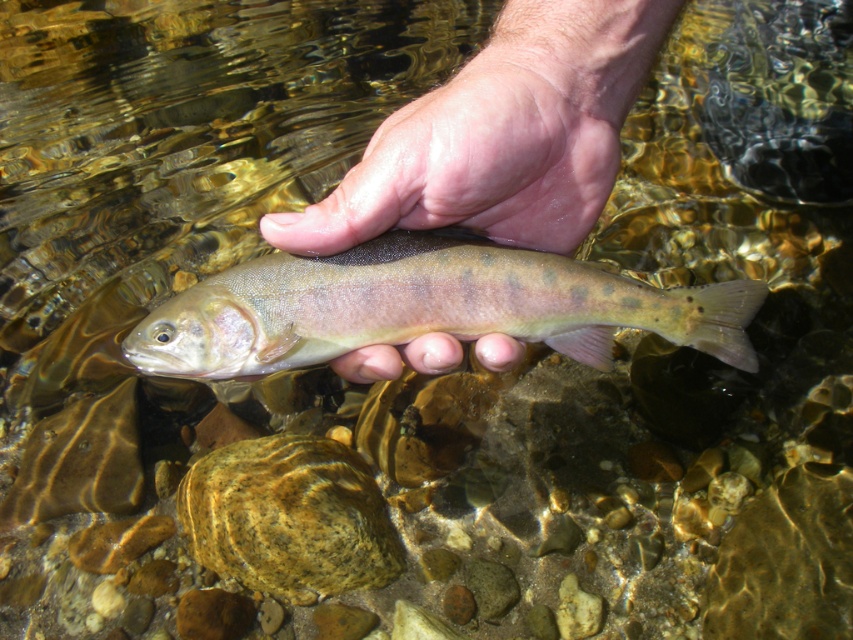
Question: Which object appears closest to the camera in this image?

Choices:
 (A) smooth skin hand at center
 (B) shiny silver fish at center

Answer: (A)

Question: Does smooth skin hand at center lie behind shiny silver fish at center?

Choices:
 (A) yes
 (B) no

Answer: (B)

Question: In this image, where is smooth skin hand at center located relative to shiny silver fish at center?

Choices:
 (A) right
 (B) left

Answer: (A)

Question: Which of the following is the farthest from the observer?

Choices:
 (A) (527, 296)
 (B) (624, 29)

Answer: (B)

Question: Can you confirm if smooth skin hand at center is positioned above shiny silver fish at center?

Choices:
 (A) yes
 (B) no

Answer: (A)